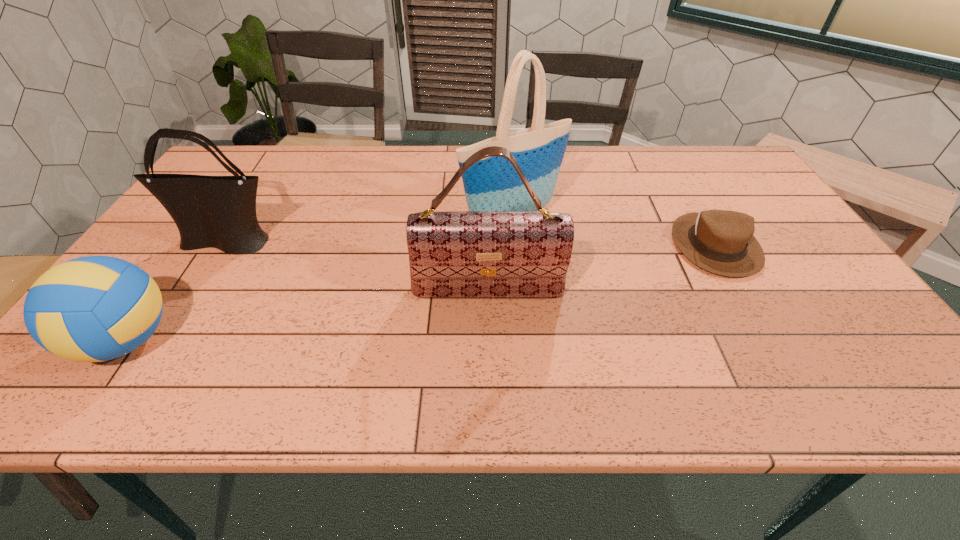
Locate an element on the screen. tote bag is located at coordinates (492, 184).

Locate an element on the screen. handbag is located at coordinates (462, 254).

The image size is (960, 540). Find the location of `shoulder bag`. shoulder bag is located at coordinates (219, 212).

Find the location of a particular element. This screenshot has height=540, width=960. volleyball is located at coordinates (96, 308).

You are a GUI agent. You are given a task and a screenshot of the screen. Output one action in this format:
    pyautogui.click(x=<x>, y=<y>)
    Task: Click on the shortest object
    
    Given the screenshot: What is the action you would take?
    pyautogui.click(x=719, y=241)

Find the location of a particular element. This screenshot has width=960, height=540. the rightmost object is located at coordinates (719, 241).

At what (x,y) coordinates should I click in order to perform the action: click on vacant space located on the right of the tallest object. Please return your answer as a coordinate pair (x, y). This screenshot has width=960, height=540. Looking at the image, I should click on tap(594, 219).

Find the location of a particular element. This screenshot has height=540, width=960. vacant space situated on the front of the handbag with the clasp is located at coordinates (489, 340).

At what (x,y) coordinates should I click in order to perform the action: click on vacant region located 0.080m on the right of the shoulder bag. Please return your answer as a coordinate pair (x, y). This screenshot has width=960, height=540. Looking at the image, I should click on (314, 242).

You are a GUI agent. You are given a task and a screenshot of the screen. Output one action in this format:
    pyautogui.click(x=<x>, y=<y>)
    Task: Click on the blank space located on the right of the second shortest object
    
    Given the screenshot: What is the action you would take?
    pyautogui.click(x=249, y=341)